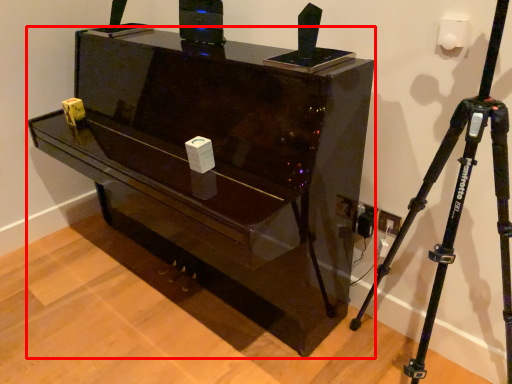
Question: Where is furniture (annotated by the red box) located in relation to tripod in the image?

Choices:
 (A) right
 (B) left

Answer: (B)